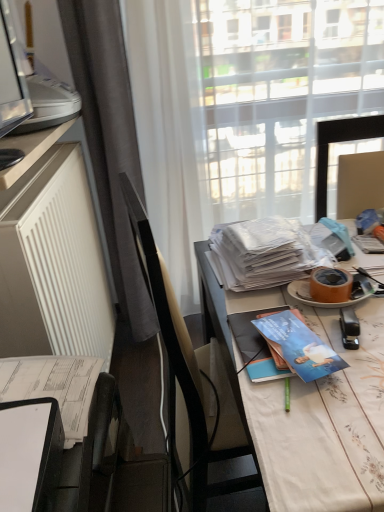
The width and height of the screenshot is (384, 512). I want to click on vacant space in front of blue glossy book at center, the 1th magazine when ordered from bottom to top, so click(x=307, y=415).